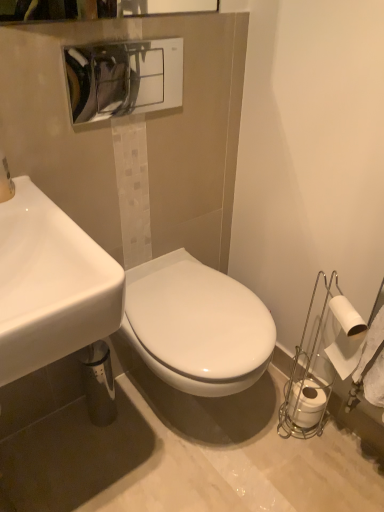
Question: Is white matte toilet paper at lower right, which is the 1th toilet paper from back to front, located within white matte toilet paper at lower right, the second toilet paper in the bottom-to-top sequence?

Choices:
 (A) no
 (B) yes

Answer: (A)

Question: From a real-world perspective, is white matte toilet paper at lower right, the first toilet paper in the top-to-bottom sequence, physically above white matte toilet paper at lower right, the first toilet paper from the bottom?

Choices:
 (A) yes
 (B) no

Answer: (A)

Question: Does white matte toilet paper at lower right, the second toilet paper in the bottom-to-top sequence, have a greater width compared to white matte toilet paper at lower right, which is the 1th toilet paper from back to front?

Choices:
 (A) no
 (B) yes

Answer: (A)

Question: Does white matte toilet paper at lower right, the second toilet paper in the bottom-to-top sequence, have a smaller size compared to white matte toilet paper at lower right, which appears as the 2th toilet paper when viewed from the front?

Choices:
 (A) yes
 (B) no

Answer: (B)

Question: Is white matte toilet paper at lower right, the first toilet paper in the top-to-bottom sequence, aimed at white matte toilet paper at lower right, the first toilet paper from the bottom?

Choices:
 (A) no
 (B) yes

Answer: (A)

Question: Considering the positions of white matte toilet paper at lower right, the first toilet paper positioned from the front, and white matte toilet paper at lower right, the first toilet paper from the bottom, in the image, is white matte toilet paper at lower right, the first toilet paper positioned from the front, bigger or smaller than white matte toilet paper at lower right, the first toilet paper from the bottom,?

Choices:
 (A) small
 (B) big

Answer: (B)

Question: In the image, is white matte toilet paper at lower right, the second toilet paper from the back, positioned in front of or behind white matte toilet paper at lower right, which is counted as the 2th toilet paper, starting from the top?

Choices:
 (A) behind
 (B) front

Answer: (B)

Question: Considering the positions of white matte toilet paper at lower right, the first toilet paper in the top-to-bottom sequence, and white matte toilet paper at lower right, which appears as the 2th toilet paper when viewed from the front, in the image, is white matte toilet paper at lower right, the first toilet paper in the top-to-bottom sequence, taller or shorter than white matte toilet paper at lower right, which appears as the 2th toilet paper when viewed from the front,?

Choices:
 (A) tall
 (B) short

Answer: (A)

Question: Based on their positions, is white matte toilet paper at lower right, the second toilet paper in the bottom-to-top sequence, located to the left or right of white matte toilet paper at lower right, the first toilet paper from the bottom?

Choices:
 (A) left
 (B) right

Answer: (B)

Question: Looking at the image, does white matte toilet paper at lower right, which is the 1th toilet paper from back to front, seem bigger or smaller compared to white glossy sink at left, the 1th sink when ordered from front to back?

Choices:
 (A) big
 (B) small

Answer: (B)

Question: From their relative heights in the image, would you say white matte toilet paper at lower right, which is the 1th toilet paper from back to front, is taller or shorter than white glossy sink at left, the 1th sink when ordered from front to back?

Choices:
 (A) short
 (B) tall

Answer: (A)

Question: From a real-world perspective, is white matte toilet paper at lower right, the first toilet paper from the bottom, physically located above or below white glossy sink at left, the 1th sink when ordered from front to back?

Choices:
 (A) below
 (B) above

Answer: (A)

Question: Relative to white glossy sink at left, the 2th sink viewed from the back, is white matte toilet paper at lower right, which is the 1th toilet paper from back to front, in front or behind?

Choices:
 (A) behind
 (B) front

Answer: (A)

Question: Considering the positions of white matte toilet paper at lower right, the second toilet paper in the bottom-to-top sequence, and matte white hand dryer at upper center in the image, is white matte toilet paper at lower right, the second toilet paper in the bottom-to-top sequence, taller or shorter than matte white hand dryer at upper center?

Choices:
 (A) tall
 (B) short

Answer: (A)

Question: In terms of width, does white matte toilet paper at lower right, the first toilet paper positioned from the front, look wider or thinner when compared to matte white hand dryer at upper center?

Choices:
 (A) wide
 (B) thin

Answer: (A)